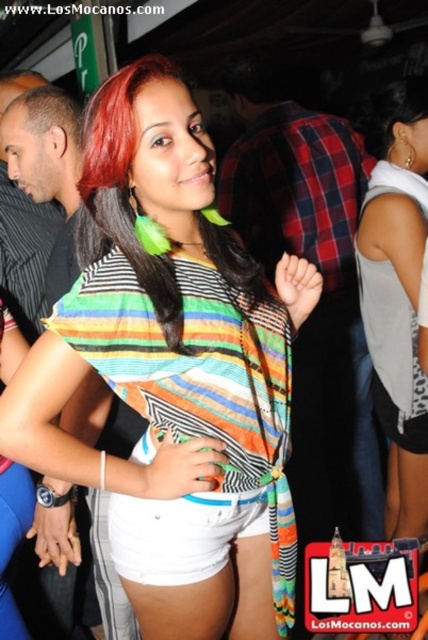
Is gray fabric tank top at center positioned at the back of white fabric shorts at lower center?

Yes, gray fabric tank top at center is further from the viewer.

Which is behind, point (424, 189) or point (184, 522)?

Positioned behind is point (424, 189).

Image resolution: width=428 pixels, height=640 pixels. I want to click on gray fabric tank top at center, so pos(398,301).

Is gray fabric tank top at center positioned in front of multicolored fabric hair at center?

No, it is behind multicolored fabric hair at center.

Does gray fabric tank top at center have a greater height compared to multicolored fabric hair at center?

Yes, gray fabric tank top at center is taller than multicolored fabric hair at center.

Who is more forward, (388,252) or (149,289)?

Point (149,289)

This screenshot has width=428, height=640. What are the coordinates of `gray fabric tank top at center` in the screenshot? It's located at (398, 301).

Can you confirm if brushed metal watch at upper left is positioned to the left of white fabric shorts at lower center?

Indeed, brushed metal watch at upper left is positioned on the left side of white fabric shorts at lower center.

Does brushed metal watch at upper left have a greater height compared to white fabric shorts at lower center?

Correct, brushed metal watch at upper left is much taller as white fabric shorts at lower center.

Locate an element on the screen. brushed metal watch at upper left is located at coordinates (47, 168).

The image size is (428, 640). In order to click on brushed metal watch at upper left in this screenshot , I will do `click(47, 168)`.